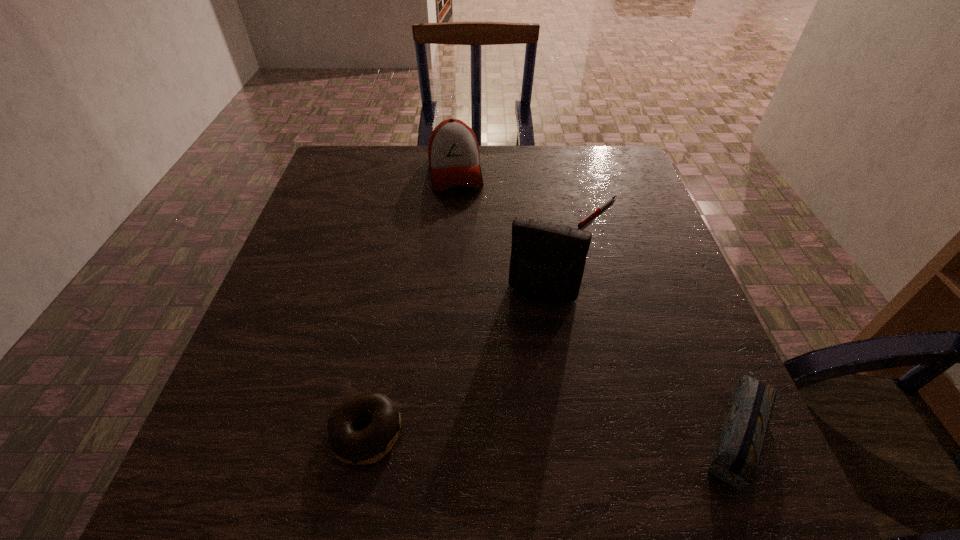
The height and width of the screenshot is (540, 960). Identify the location of vacant spot on the desktop that is between the second shortest object and the pencil box and is positioned on the clicker of the pen. (584, 429).

At what (x,y) coordinates should I click in order to perform the action: click on vacant space on the desktop that is between the fourth tallest object and the pencil box and is positioned with an open flap on the third farthest object. Please return your answer as a coordinate pair (x, y). The height and width of the screenshot is (540, 960). Looking at the image, I should click on (500, 430).

Find the location of `free space on the desktop that is between the fourth tallest object and the pencil box and is positioned on the front-facing side of the second tallest object`. free space on the desktop that is between the fourth tallest object and the pencil box and is positioned on the front-facing side of the second tallest object is located at coordinates (498, 430).